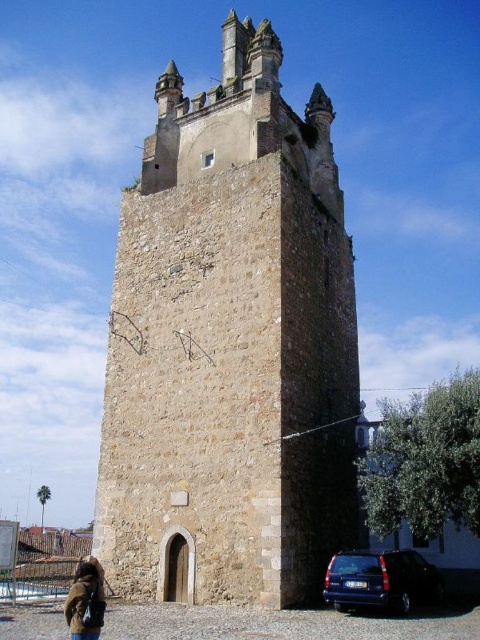
Question: Can you confirm if brown stone tower at center is positioned above blue metallic van at lower right?

Choices:
 (A) yes
 (B) no

Answer: (A)

Question: Estimate the real-world distances between objects in this image. Which object is closer to the brown leather jacket at lower left?

Choices:
 (A) blue metallic van at lower right
 (B) brown stone tower at center

Answer: (A)

Question: Estimate the real-world distances between objects in this image. Which object is farther from the brown leather jacket at lower left?

Choices:
 (A) brown stone tower at center
 (B) blue metallic van at lower right

Answer: (A)

Question: Which object appears closest to the camera in this image?

Choices:
 (A) blue metallic van at lower right
 (B) brown stone tower at center

Answer: (A)

Question: Is brown stone tower at center positioned at the back of blue metallic van at lower right?

Choices:
 (A) no
 (B) yes

Answer: (B)

Question: In this image, where is brown stone tower at center located relative to brown leather jacket at lower left?

Choices:
 (A) left
 (B) right

Answer: (B)